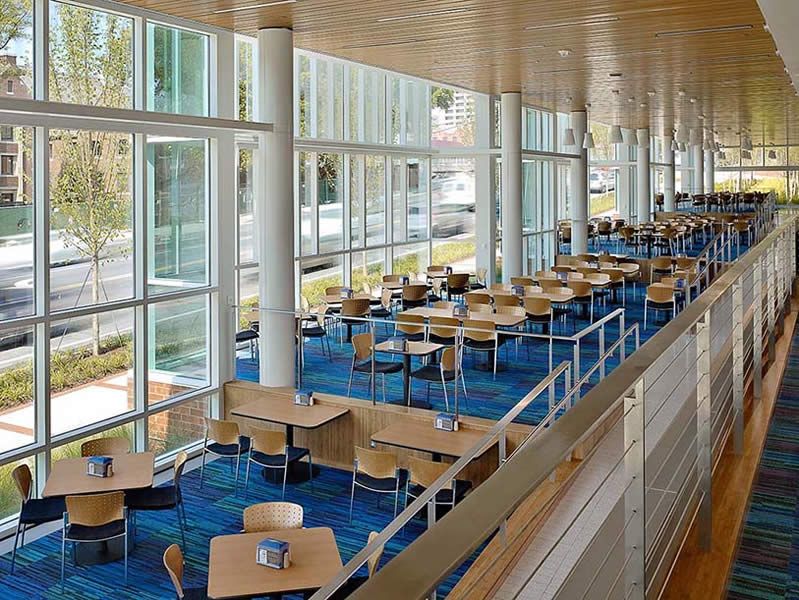
The height and width of the screenshot is (600, 799). Find the location of `long rectangular table or desk`. long rectangular table or desk is located at coordinates [x=507, y=319], [x=559, y=297], [x=630, y=270], [x=601, y=282].